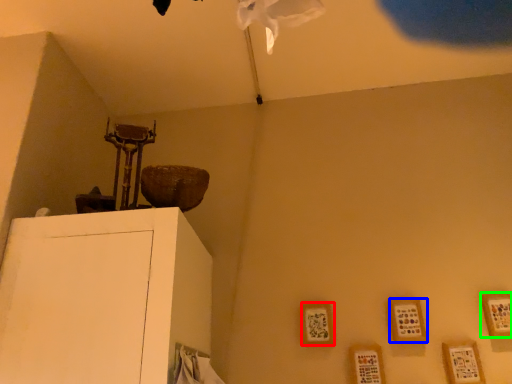
Question: Considering the real-world distances, which object is farthest from picture frame (highlighted by a red box)? picture frame (highlighted by a blue box) or picture frame (highlighted by a green box)?

Choices:
 (A) picture frame
 (B) picture frame

Answer: (B)